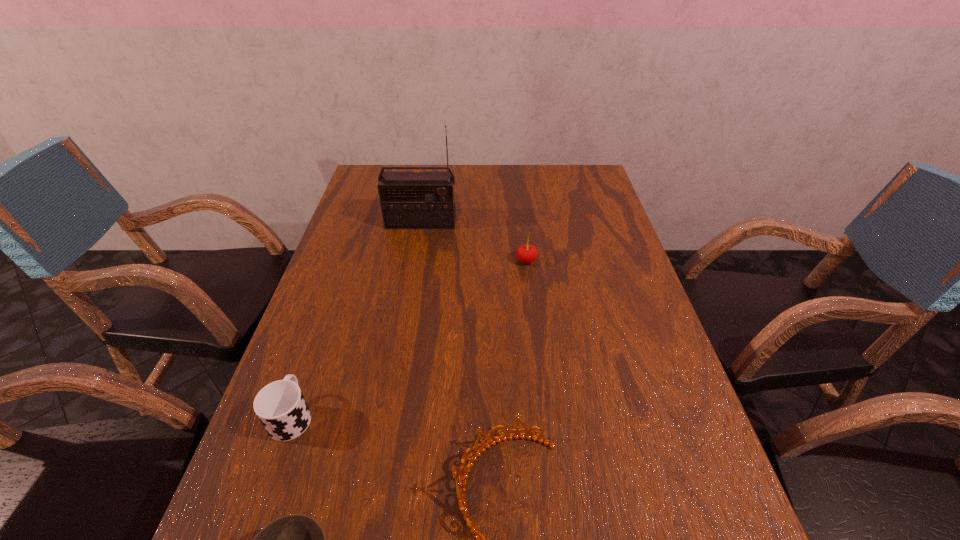
Find the location of a particular element. This screenshot has width=960, height=540. cup that is at the left edge is located at coordinates (280, 406).

Find the location of a particular element. free space at the far edge is located at coordinates (482, 177).

At what (x,y) coordinates should I click in order to perform the action: click on free spot at the left edge of the desktop. Please return your answer as a coordinate pair (x, y). Looking at the image, I should click on (300, 329).

At what (x,y) coordinates should I click in order to perform the action: click on vacant space at the right edge. Please return your answer as a coordinate pair (x, y). Looking at the image, I should click on [x=604, y=246].

The image size is (960, 540). I want to click on free area in between the fourth nearest object and the farthest object, so click(x=473, y=241).

Where is `free space between the second farthest object and the farthest object`? free space between the second farthest object and the farthest object is located at coordinates click(473, 241).

I want to click on vacant space that's between the cherry and the radio receiver, so click(x=473, y=241).

Identify the location of unoccupied position between the second farthest object and the cup. (409, 339).

This screenshot has height=540, width=960. I want to click on unoccupied position between the cherry and the cup, so click(409, 339).

Choose which object is the fourth nearest neighbor to the fourth nearest object. Please provide its 2D coordinates. Your answer should be formatted as a tuple, i.e. [(x, y)], where the tuple contains the x and y coordinates of a point satisfying the conditions above.

[(296, 539)]